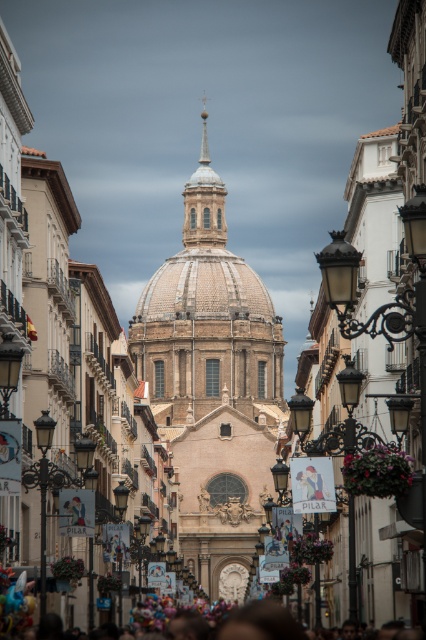
You are a photographer standing on the street and want to capture both the beige stone church at center and the multicolored fabric crowd at lower center in a single wide shot. Which object will occupy more space in the photo?

The beige stone church at center will occupy more space in the photo because its width surpasses that of the multicolored fabric crowd at lower center.

You are standing on the street in front of the beige stone church at center. You want to take a photo of the church with your smartphone. Considering the distance, will you need to zoom in or zoom out to capture the entire church in the frame?

The beige stone church at center is 156.11 meters away from viewer. Since the church is quite far away, you will need to zoom out to capture the entire church in the frame.

You are standing at the end of the street looking towards the beige stone church at center and the multicolored fabric crowd at lower center. Which object appears bigger in the image?

The beige stone church at center appears bigger than the multicolored fabric crowd at lower center because it has a larger size.